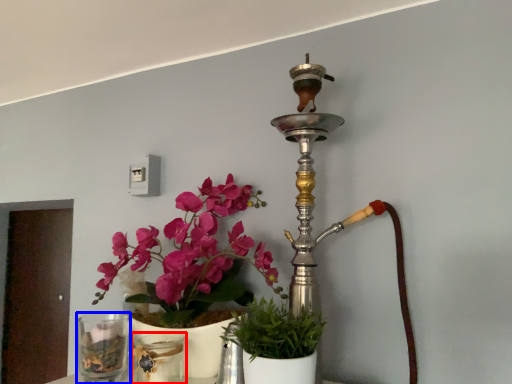
Question: Which object is further to the camera taking this photo, glass vase (highlighted by a red box) or vase (highlighted by a blue box)?

Choices:
 (A) glass vase
 (B) vase

Answer: (B)